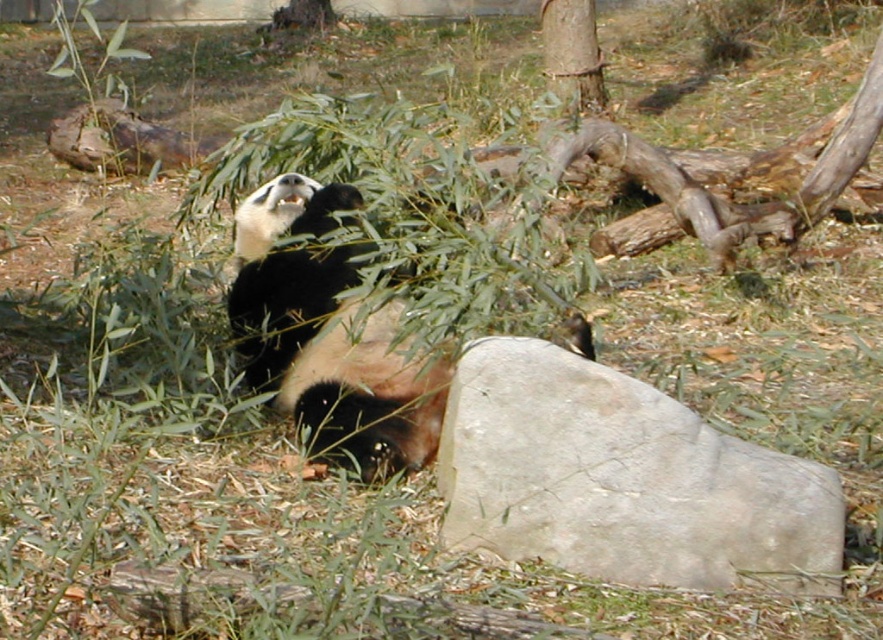
You are standing in front of the panda enclosure and want to toss a small apple to the gray rock at center. The apple can travel 8 feet. Will it reach the rock?

The gray rock at center is 9.35 feet away from the viewer, so the apple, which can travel 8 feet, will not reach the rock.

You are a zookeeper who wants to place a feeding tray for the black fur panda at center. The feeding tray needs to be placed in a spot that is not under the smooth brown tree trunk at upper center to avoid it getting wet from the tree. Where should you place the feeding tray?

The black fur panda at center is positioned under the smooth brown tree trunk at upper center. To avoid the feeding tray getting wet from the tree, place it in an area away from the tree trunk, such as the open space to the side or behind the panda where there is no overhang.

You are a wildlife photographer trying to capture a closeup of the black fur panda at center and the smooth brown tree trunk at upper center in the same frame. Based on their sizes, which one should you focus on first to ensure both fit in the photo?

The black fur panda at center is larger in size than the smooth brown tree trunk at upper center, so you should focus on the black fur panda at center first to ensure both fit in the photo.